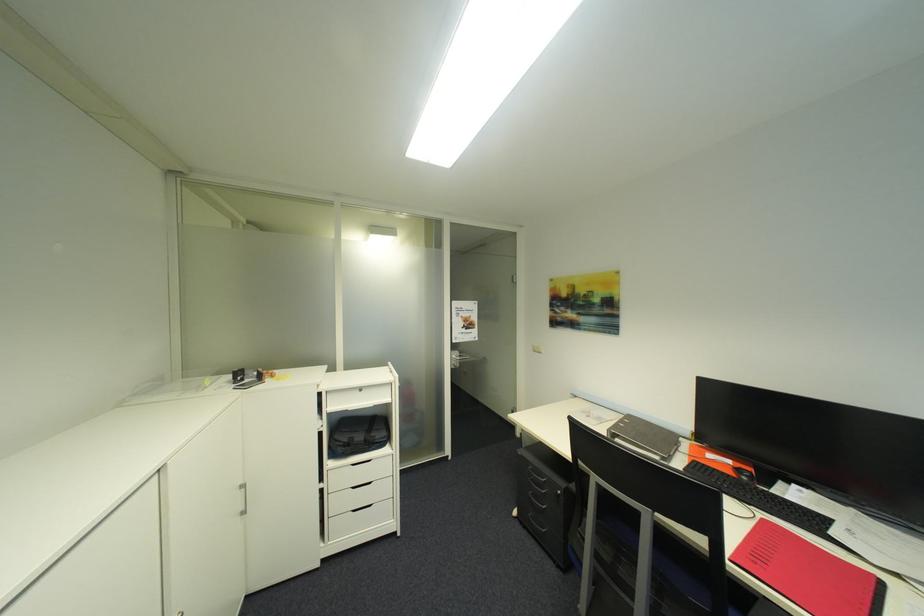
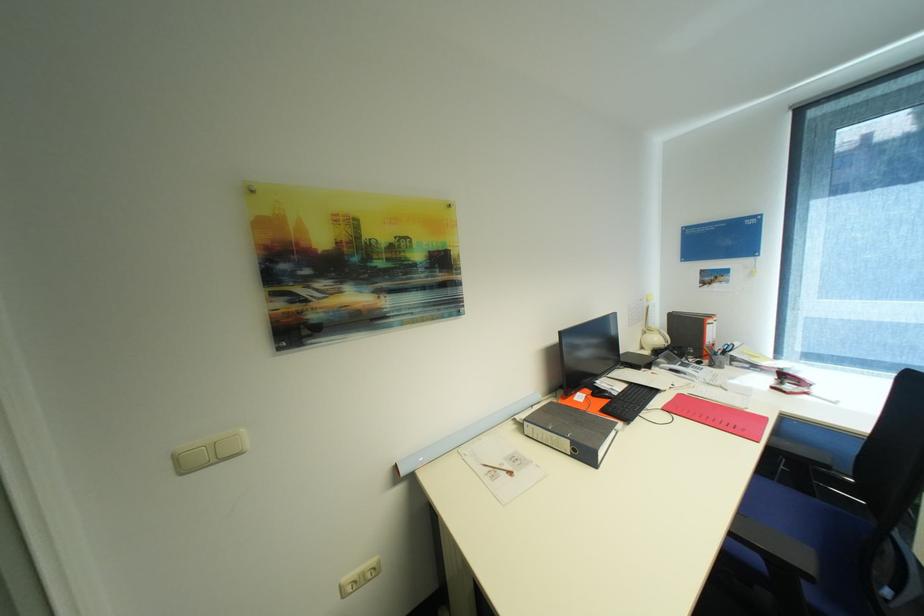
Find the pixel in the second image that matches (x=541, y=347) in the first image.

(185, 458)